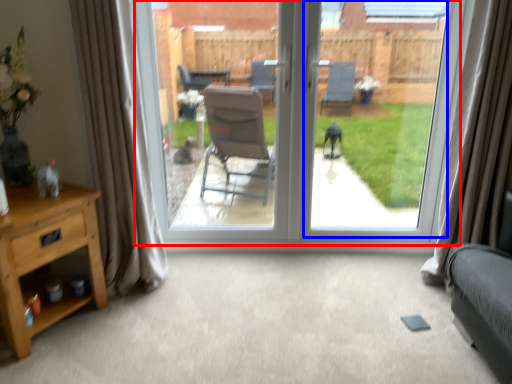
Question: Which of the following is the farthest to the observer, window (highlighted by a red box) or window screen (highlighted by a blue box)?

Choices:
 (A) window
 (B) window screen

Answer: (A)